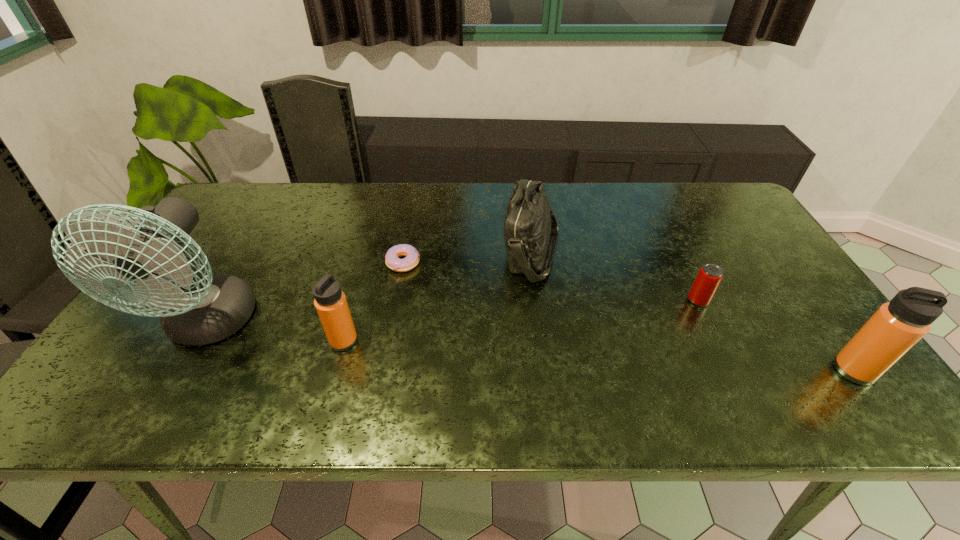
The width and height of the screenshot is (960, 540). In order to click on free space between the leftmost object and the fifth object from left to right in this screenshot , I will do `click(453, 313)`.

The image size is (960, 540). What are the coordinates of `free space between the beer can and the fan` in the screenshot? It's located at (453, 313).

The height and width of the screenshot is (540, 960). In order to click on vacant space in between the shoulder bag and the doughnut in this screenshot , I will do `click(468, 258)`.

Identify the location of free space between the doughnut and the beer can. (551, 281).

Where is `unoccupied area between the tallest object and the taller thermos bottle`? unoccupied area between the tallest object and the taller thermos bottle is located at coordinates (531, 348).

You are a GUI agent. You are given a task and a screenshot of the screen. Output one action in this format:
    pyautogui.click(x=<x>, y=<y>)
    Task: Click on the empty space that is in between the fifth object from left to right and the leftmost object
    The width and height of the screenshot is (960, 540).
    Given the screenshot: What is the action you would take?
    pyautogui.click(x=453, y=313)

Find the location of a particular element. Image resolution: width=960 pixels, height=540 pixels. free space that is in between the left thermos bottle and the second shortest object is located at coordinates (521, 321).

What are the coordinates of `unoccupied position between the shortest object and the tallest object` in the screenshot? It's located at (305, 294).

Choose which object is the second nearest neighbor to the shorter thermos bottle. Please provide its 2D coordinates. Your answer should be formatted as a tuple, i.e. [(x, y)], where the tuple contains the x and y coordinates of a point satisfying the conditions above.

[(412, 257)]

What are the coordinates of `the closest object to the second object from right to left` in the screenshot? It's located at (898, 325).